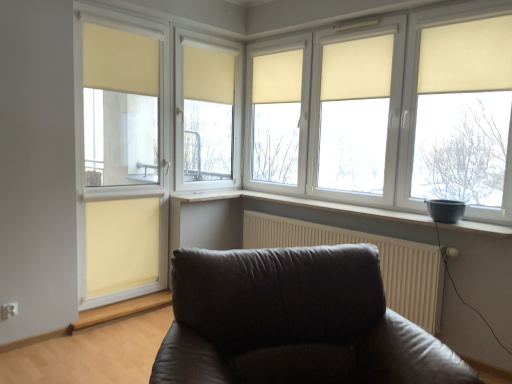
Locate an element on the screen. free space above beige fabric curtain at upper right, which is the sixth curtain from left to right (from a real-world perspective) is located at coordinates (461, 13).